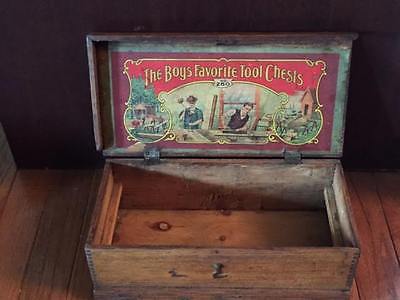
Locate an element on the screen. The width and height of the screenshot is (400, 300). flooring is located at coordinates pos(375,180).